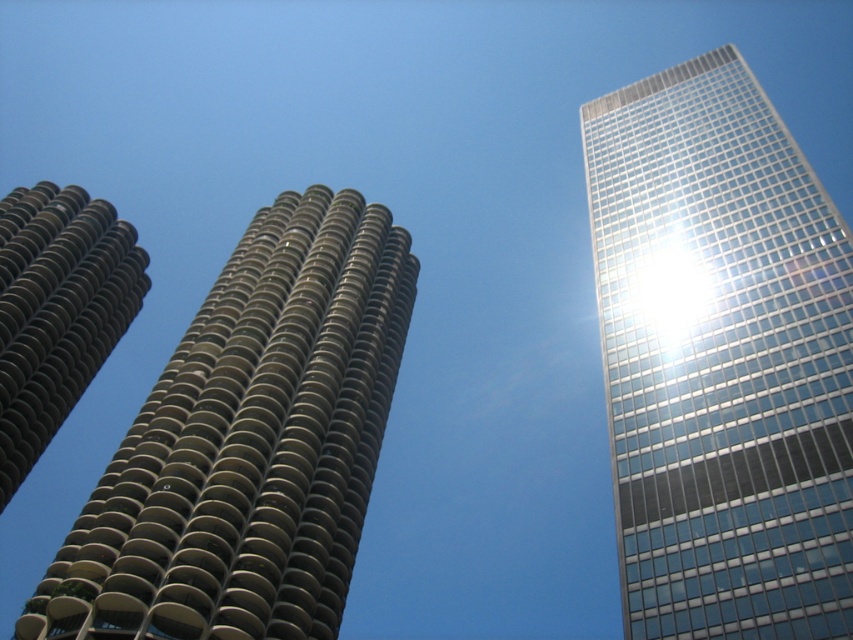
How distant is brown concrete tower at left from brown textured tower at left?

The distance of brown concrete tower at left from brown textured tower at left is 21.57 meters.

Is brown concrete tower at left taller than brown textured tower at left?

Indeed, brown concrete tower at left has a greater height compared to brown textured tower at left.

Which is in front, point (196, 458) or point (27, 196)?

Positioned in front is point (196, 458).

Locate an element on the screen. The image size is (853, 640). brown concrete tower at left is located at coordinates (248, 444).

Which is above, transparent glass skyscraper at upper right or brown concrete tower at left?

transparent glass skyscraper at upper right

Can you confirm if transparent glass skyscraper at upper right is wider than brown concrete tower at left?

Indeed, transparent glass skyscraper at upper right has a greater width compared to brown concrete tower at left.

Image resolution: width=853 pixels, height=640 pixels. I want to click on transparent glass skyscraper at upper right, so click(721, 358).

I want to click on transparent glass skyscraper at upper right, so click(721, 358).

Between transparent glass skyscraper at upper right and brown textured tower at left, which one is positioned higher?

transparent glass skyscraper at upper right is above.

Can you confirm if transparent glass skyscraper at upper right is positioned to the left of brown textured tower at left?

Incorrect, transparent glass skyscraper at upper right is not on the left side of brown textured tower at left.

Does point (712, 51) come in front of point (1, 509)?

No, it is not.

You are a GUI agent. You are given a task and a screenshot of the screen. Output one action in this format:
    pyautogui.click(x=<x>, y=<y>)
    Task: Click on the transparent glass skyscraper at upper right
    
    Given the screenshot: What is the action you would take?
    pyautogui.click(x=721, y=358)